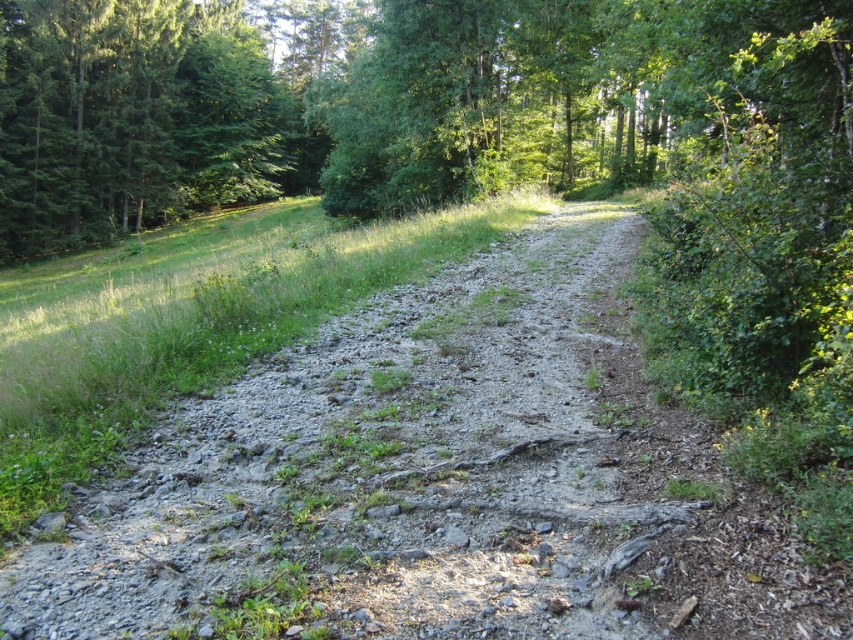
Is gray gravel path at center further to camera compared to green leafy tree at center?

No, gray gravel path at center is in front of green leafy tree at center.

Who is lower down, gray gravel path at center or green leafy tree at center?

gray gravel path at center is below.

Is point (809, 572) closer to camera compared to point (241, 131)?

Yes.

What are the coordinates of `gray gravel path at center` in the screenshot? It's located at (434, 483).